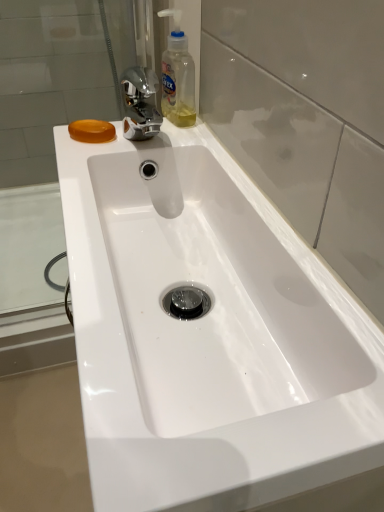
Where is `free space in front of translucent plastic bottle at upper center`? free space in front of translucent plastic bottle at upper center is located at coordinates (168, 147).